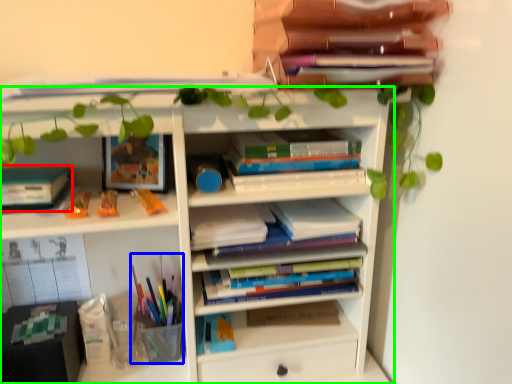
Question: Which is nearer to the paperback book (highlighted by a red box)? stationery (highlighted by a blue box) or shelf (highlighted by a green box).

Choices:
 (A) stationery
 (B) shelf

Answer: (B)